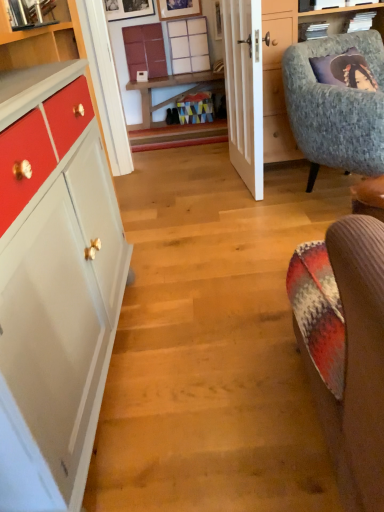
The width and height of the screenshot is (384, 512). What are the coordinates of `free space above matte wood cabinet at upper center (from a real-world perspective)` in the screenshot? It's located at (148, 19).